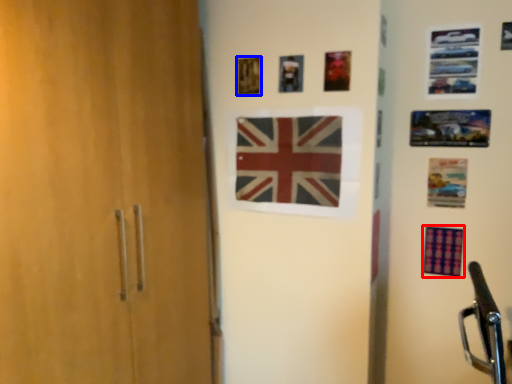
Question: Among these objects, which one is nearest to the camera, flag (highlighted by a red box) or picture frame (highlighted by a blue box)?

Choices:
 (A) flag
 (B) picture frame

Answer: (B)